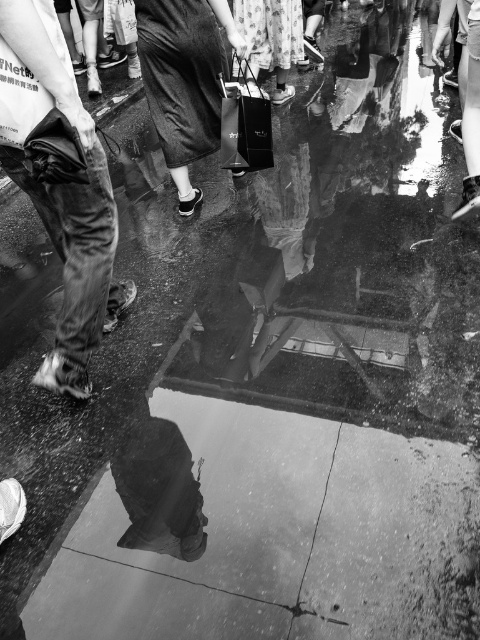
Between point (62, 385) and point (260, 124), which one is positioned behind?

The point (260, 124) is more distant.

You are a GUI agent. You are given a task and a screenshot of the screen. Output one action in this format:
    pyautogui.click(x=<x>, y=<y>)
    Task: Click on the jeans at left
    
    Given the screenshot: What is the action you would take?
    pyautogui.click(x=60, y=188)

Is smooth concrete sidewalk at lower center thinner than matte black shopping bag at center?

No, smooth concrete sidewalk at lower center is not thinner than matte black shopping bag at center.

Consider the image. Which is below, smooth concrete sidewalk at lower center or matte black shopping bag at center?

smooth concrete sidewalk at lower center

Where is `smooth concrete sidewalk at lower center`? smooth concrete sidewalk at lower center is located at coordinates (268, 532).

Does point (354, 468) lie behind point (2, 150)?

Yes, point (354, 468) is farther from viewer.

Who is positioned more to the right, smooth concrete sidewalk at lower center or jeans at left?

smooth concrete sidewalk at lower center

In order to click on smooth concrete sidewalk at lower center in this screenshot , I will do `click(268, 532)`.

The height and width of the screenshot is (640, 480). In order to click on smooth concrete sidewalk at lower center in this screenshot , I will do point(268,532).